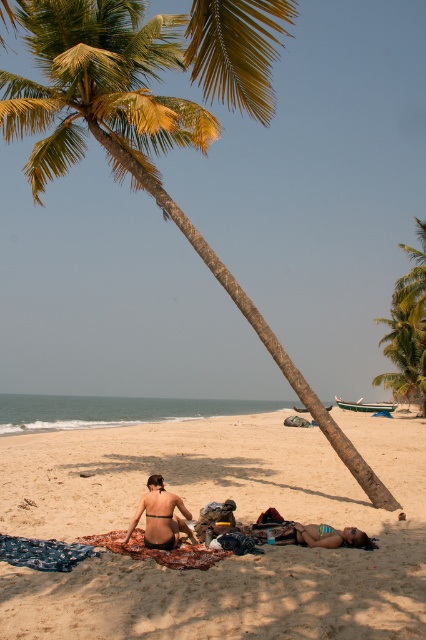
You are a photographer trying to capture a photo of the bright pink bikini at center and the matte black bikini at center. Since you want to highlight the height difference between them, which one should you focus on to emphasize their size?

The bright pink bikini at center has a greater height compared to the matte black bikini at center, so focusing on the bright pink bikini at center would emphasize its larger size.